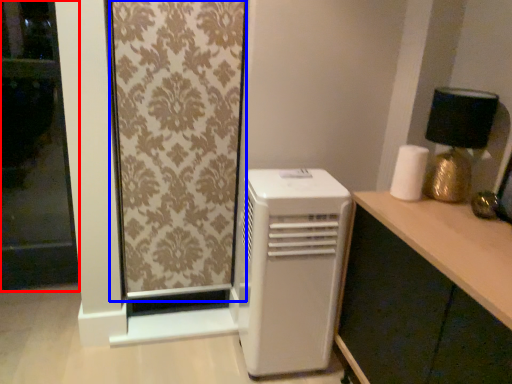
Question: Among these objects, which one is farthest to the camera, screen door (highlighted by a red box) or curtain (highlighted by a blue box)?

Choices:
 (A) screen door
 (B) curtain

Answer: (A)